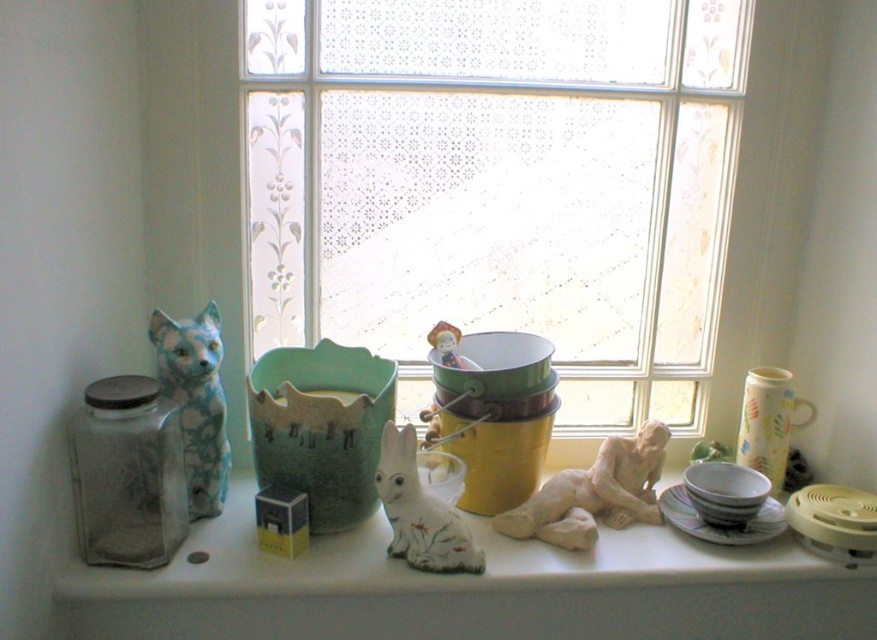
You are a delivery robot that needs to place a small package on the windowsill. The package must be placed at point (439, 576). However, there is already an object at that location. Which object is blocking the delivery robot from placing the package there?

The point (439, 576) is on the white matte rabbit at center, so the white matte rabbit at center is blocking the delivery robot from placing the package there.

You are a delivery person who needs to place a small package on the windowsill. The package must be placed at the exact point marked as point (x=769, y=420). However, you notice that this point is on an object already present on the windowsill. Which object is it?

The point (x=769, y=420) is on the matte ceramic vase at right.

You are organizing items on a windowsill and want to place a new decorative item between the matte ceramic vase at right and the matte white bowl at center. The new item is 3 inches wide. Is there enough space between them to fit the new item?

The distance between the matte ceramic vase at right and the matte white bowl at center is 4.04 inches. Since the new item is 3 inches wide, there is enough space to fit it between them.